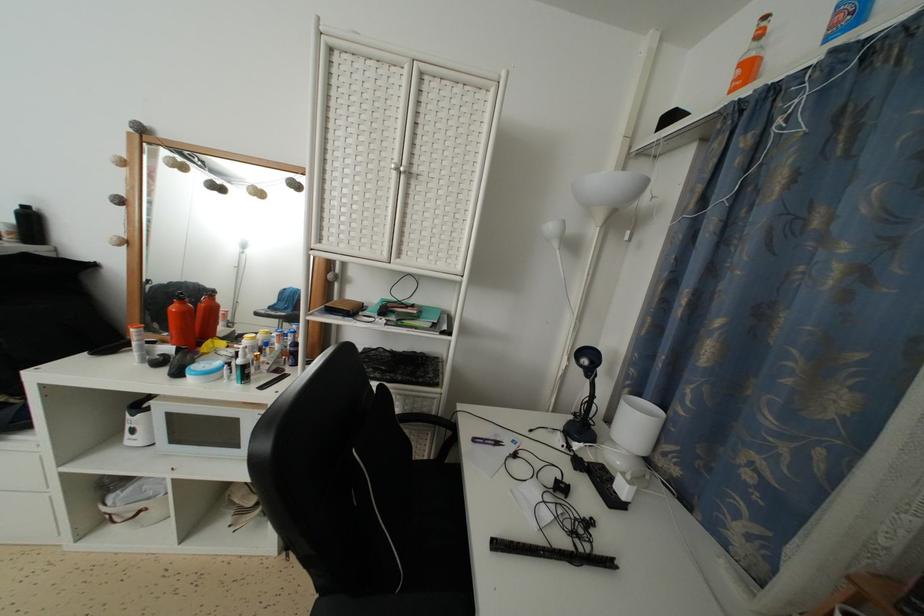
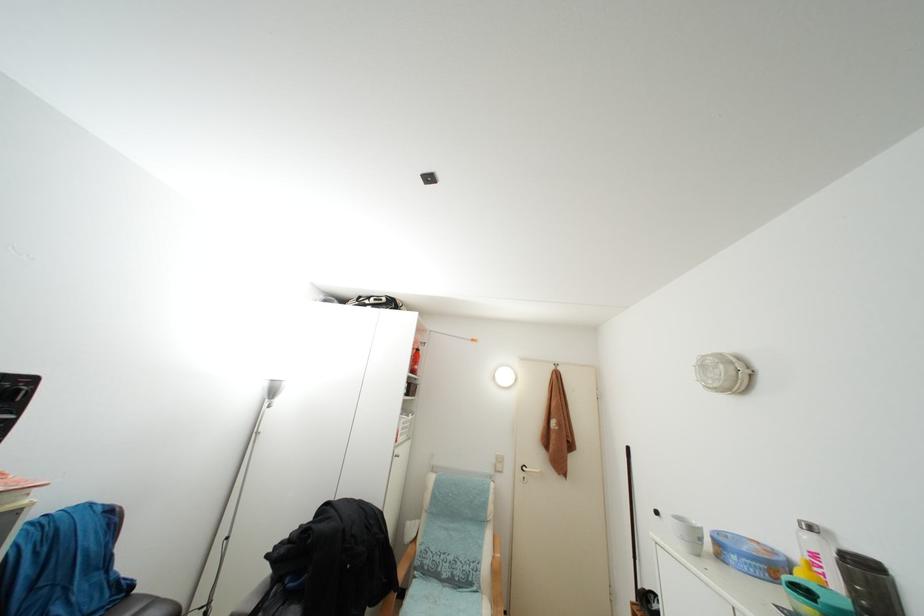
The images are taken continuously from a first-person perspective. In which direction is your viewpoint rotating?

→ The rotation direction of the camera is left-up.